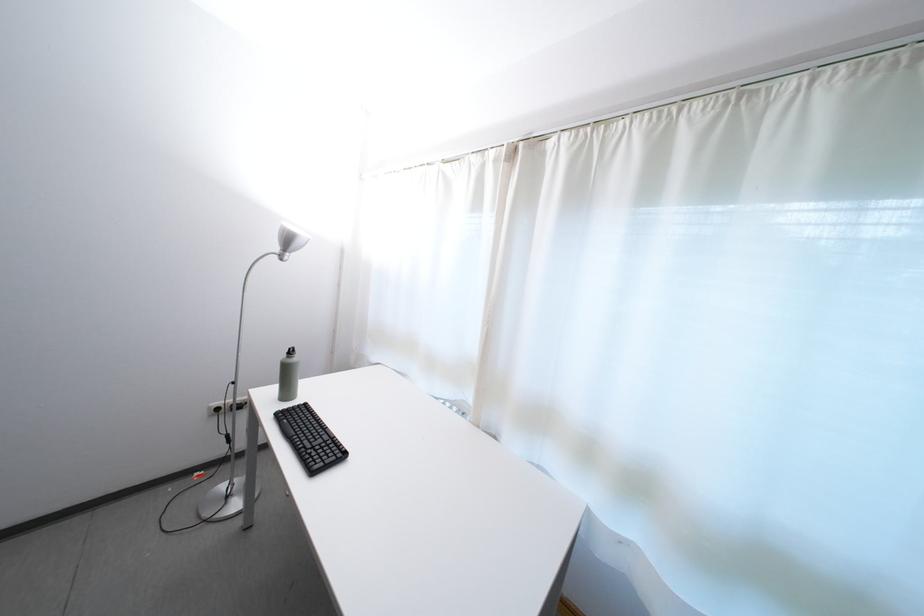
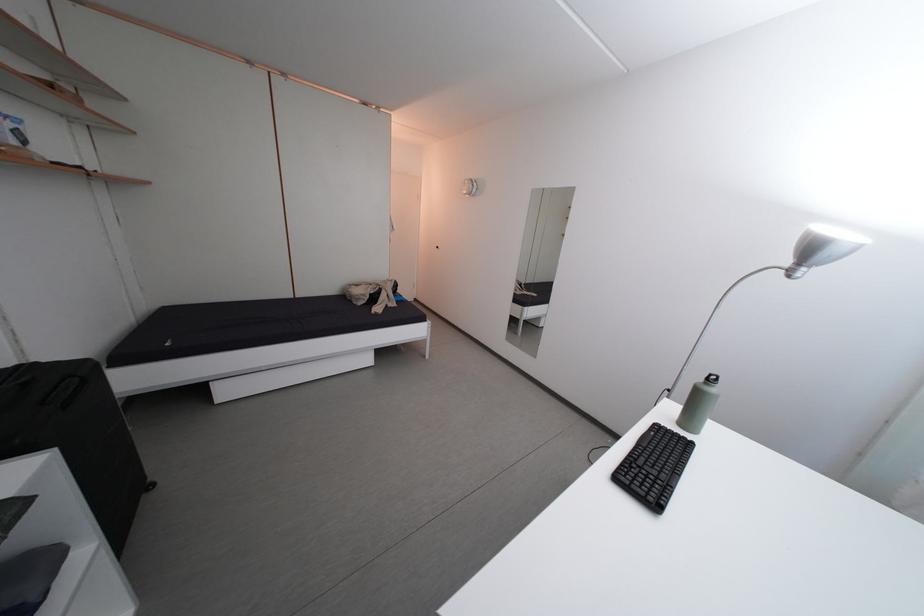
In the second image, find the point that corresponds to point (322, 477) in the first image.

(626, 485)